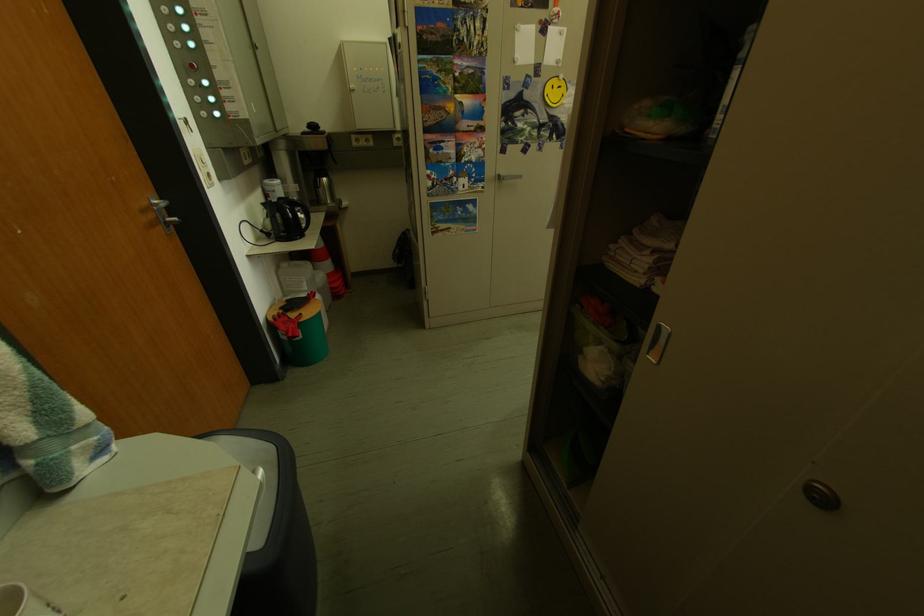
What do you see at coordinates (160, 208) in the screenshot? I see `a metal door handle` at bounding box center [160, 208].